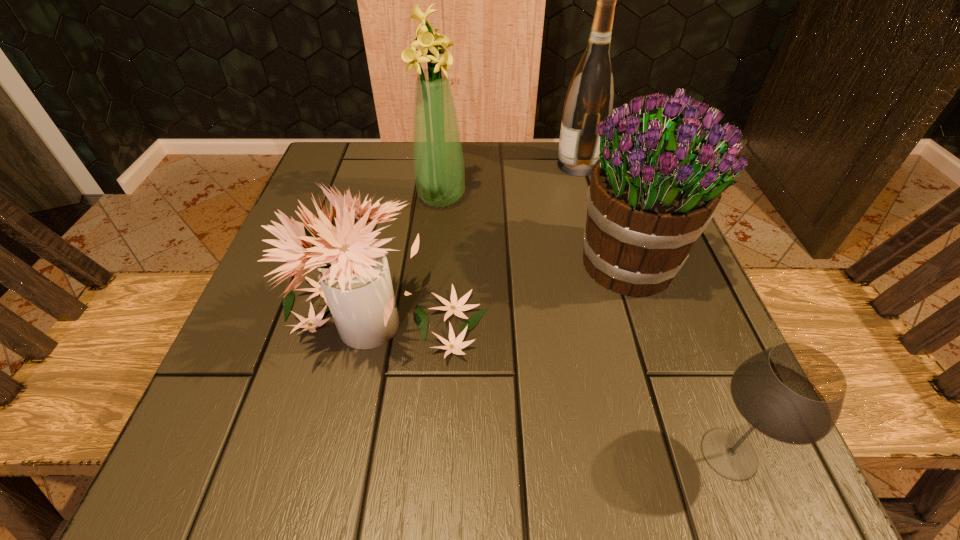
Locate which bouquet is the second closest to the farthest object. Please provide its 2D coordinates. Your answer should be formatted as a tuple, i.e. [(x, y)], where the tuple contains the x and y coordinates of a point satisfying the conditions above.

[(438, 162)]

Where is `the second closest bouquet relative to the third tallest object`? This screenshot has width=960, height=540. the second closest bouquet relative to the third tallest object is located at coordinates (438, 162).

Where is `blank area in the image that satisfies the following two spatial constraints: 1. on the label of the farthest object; 2. on the left side of the shortest object`? blank area in the image that satisfies the following two spatial constraints: 1. on the label of the farthest object; 2. on the left side of the shortest object is located at coordinates point(660,454).

You are a GUI agent. You are given a task and a screenshot of the screen. Output one action in this format:
    pyautogui.click(x=<x>, y=<y>)
    Task: Click on the vacant space that satisfies the following two spatial constraints: 1. on the label of the farthest object; 2. on the left side of the second tallest bouquet
    
    Given the screenshot: What is the action you would take?
    pyautogui.click(x=606, y=264)

Locate an element on the screen. The height and width of the screenshot is (540, 960). free spot that satisfies the following two spatial constraints: 1. on the back side of the shortest bouquet; 2. on the left side of the rightmost bouquet is located at coordinates (393, 264).

Find the location of a particular element. vacant space that satisfies the following two spatial constraints: 1. on the label of the nearest object; 2. on the right side of the wine bottle is located at coordinates (660, 454).

At what (x,y) coordinates should I click in order to perform the action: click on vacant space that satisfies the following two spatial constraints: 1. on the label of the farthest object; 2. on the left side of the rightmost bouquet. Please return your answer as a coordinate pair (x, y). The height and width of the screenshot is (540, 960). Looking at the image, I should click on (606, 264).